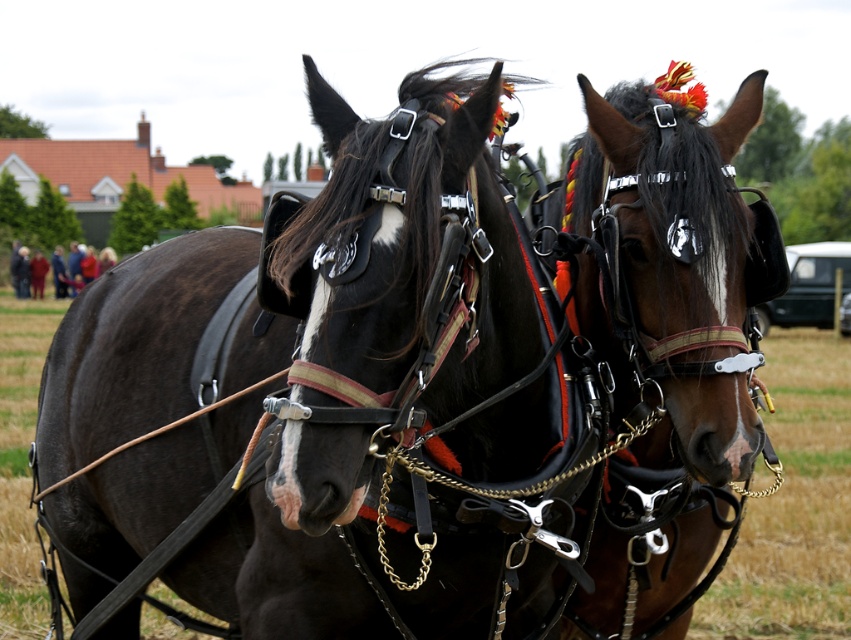
Question: Can you confirm if shiny black harness at center is wider than shiny brown horse at center?

Choices:
 (A) no
 (B) yes

Answer: (B)

Question: Does shiny black harness at center have a larger size compared to red wool coat at left?

Choices:
 (A) no
 (B) yes

Answer: (A)

Question: Is shiny brown horse at center thinner than red wool coat at left?

Choices:
 (A) no
 (B) yes

Answer: (B)

Question: Which of the following is the farthest from the observer?

Choices:
 (A) shiny brown horse at center
 (B) shiny black harness at center

Answer: (A)

Question: Among these objects, which one is farthest from the camera?

Choices:
 (A) red wool coat at left
 (B) shiny brown horse at center

Answer: (A)

Question: Which point is closer to the camera?

Choices:
 (A) shiny black harness at center
 (B) shiny brown horse at center

Answer: (A)